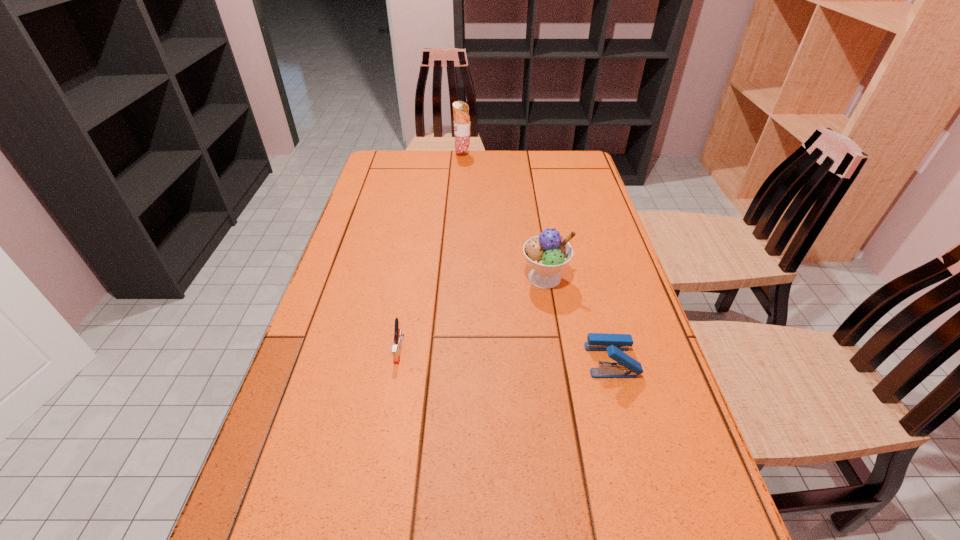
Where is `the farthest object`? the farthest object is located at coordinates (460, 109).

Find the location of a particular element. Image resolution: width=960 pixels, height=540 pixels. the third object from right to left is located at coordinates (460, 109).

Locate an element on the screen. The image size is (960, 540). the third shortest object is located at coordinates (547, 254).

Where is `the second farthest object`? The height and width of the screenshot is (540, 960). the second farthest object is located at coordinates (547, 254).

The image size is (960, 540). What are the coordinates of `the right stapler` in the screenshot? It's located at (625, 366).

This screenshot has height=540, width=960. Identify the location of the leftmost object. (398, 334).

Locate an element on the screen. Image resolution: width=960 pixels, height=540 pixels. vacant area located on the right of the burrito is located at coordinates (545, 154).

Where is `vacant space located on the left of the third nearest object`? vacant space located on the left of the third nearest object is located at coordinates (395, 278).

Identify the location of vacant space located on the front of the rightmost object. The height and width of the screenshot is (540, 960). (635, 444).

Find the location of a particular element. vacant point located 0.220m on the handle side of the leftmost object is located at coordinates (379, 461).